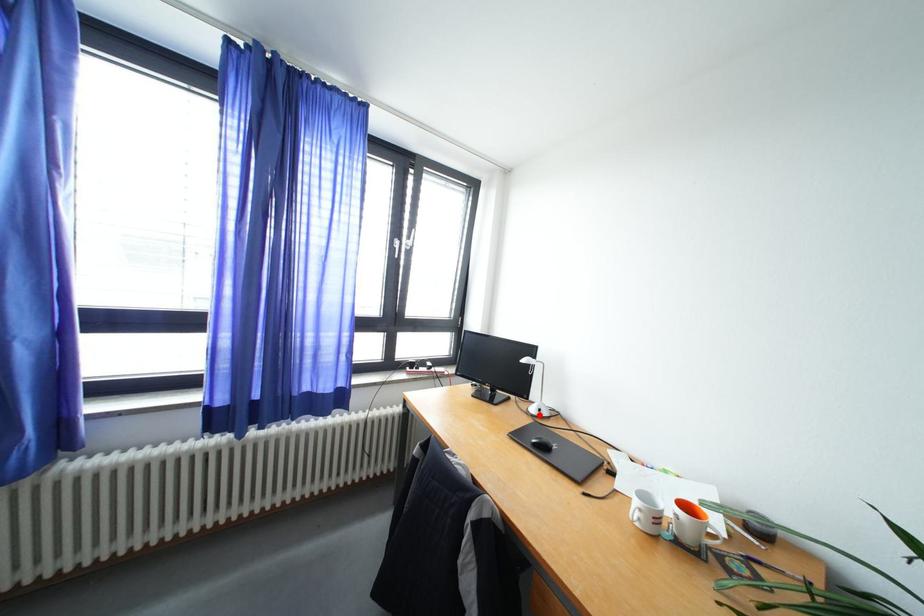
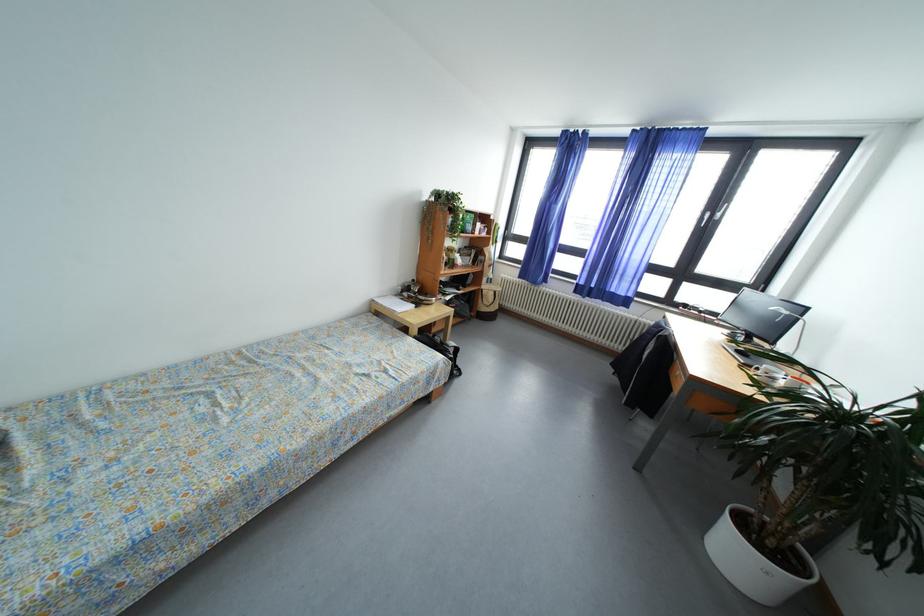
Question: I am providing you with two images of the same scene from different viewpoints. A red point is marked on the first image. Is the red point's position out of view in image 2?

Choices:
 (A) Yes
 (B) No

Answer: (A)